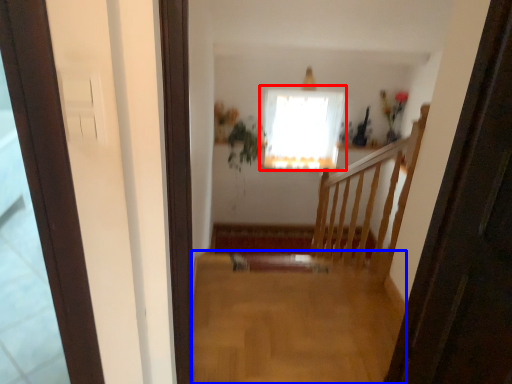
Question: Which object is further to the camera taking this photo, window (highlighted by a red box) or plain (highlighted by a blue box)?

Choices:
 (A) window
 (B) plain

Answer: (A)